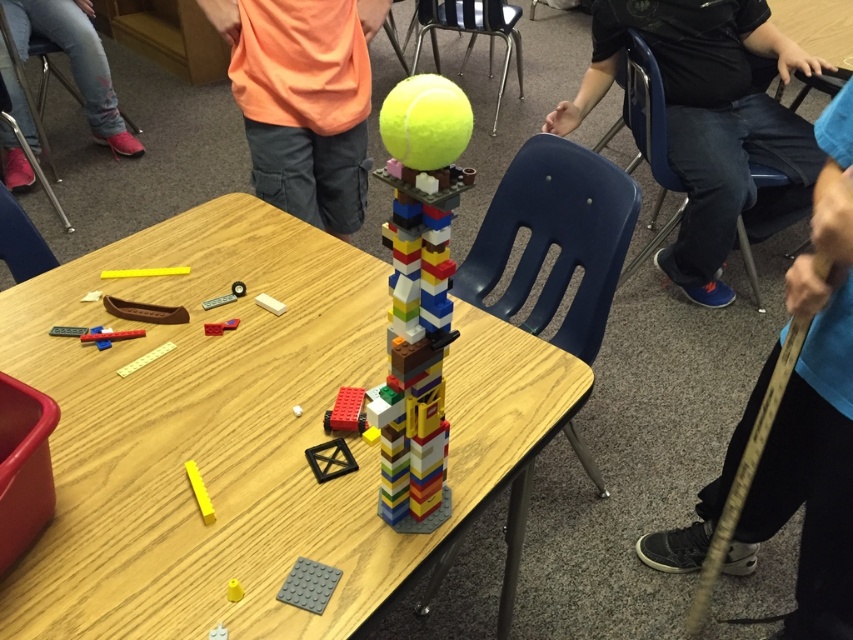
Question: Is wooden table at center smaller than blue plastic chair at right?

Choices:
 (A) yes
 (B) no

Answer: (B)

Question: In this image, where is blue jeans at center located relative to yellow plastic block at center?

Choices:
 (A) right
 (B) left

Answer: (A)

Question: Based on their relative distances, which object is nearer to the orange fabric shirt at upper center?

Choices:
 (A) blue plastic chair at center
 (B) blue jeans at center
 (C) wooden table at center
 (D) denim jeans at lower left

Answer: (C)

Question: Is yellow matte plastic stick at lower left bigger than yellow plastic block at center?

Choices:
 (A) no
 (B) yes

Answer: (B)

Question: Which is nearer to the denim jeans at lower left?

Choices:
 (A) blue plastic chair at right
 (B) yellow matte plastic stick at lower left
 (C) blue jeans at center
 (D) yellow plastic block at center

Answer: (A)

Question: Which object is the farthest from the blue jeans at center?

Choices:
 (A) denim jeans at lower left
 (B) wooden table at center
 (C) orange fabric shirt at upper center

Answer: (A)